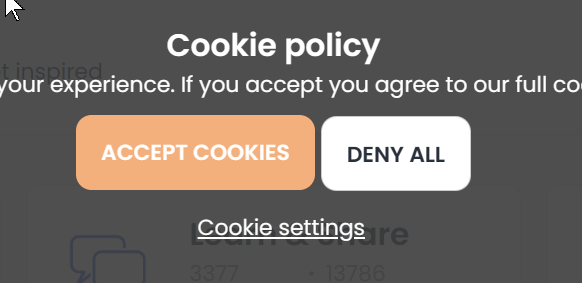
Where is `mouse`? mouse is located at coordinates (10, 9).